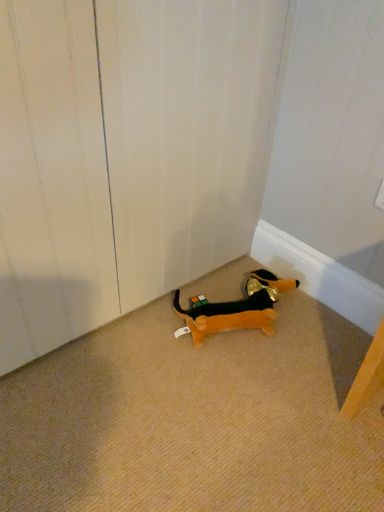
Find the location of a particular element. The width and height of the screenshot is (384, 512). free point in front of velvet orange dog at lower center is located at coordinates (249, 384).